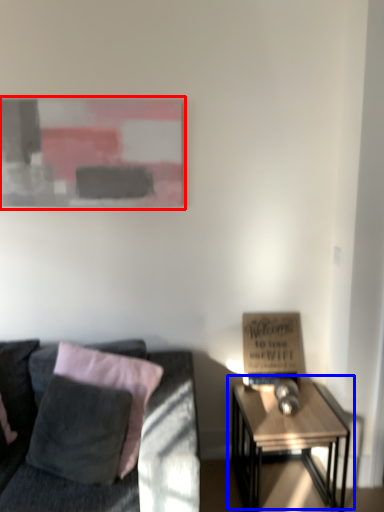
Question: Among these objects, which one is farthest to the camera, picture frame (highlighted by a red box) or table (highlighted by a blue box)?

Choices:
 (A) picture frame
 (B) table

Answer: (A)